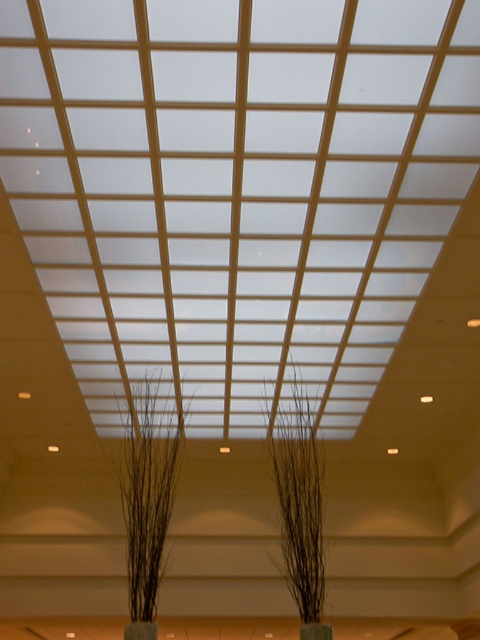
Question: Can you confirm if brown matte plant at center is bigger than black matte plant at center?

Choices:
 (A) yes
 (B) no

Answer: (A)

Question: Which point appears closest to the camera in this image?

Choices:
 (A) (305, 628)
 (B) (135, 627)
 (C) (132, 611)
 (D) (299, 563)

Answer: (B)

Question: Which point is closer to the camera?

Choices:
 (A) (305, 465)
 (B) (144, 449)
 (C) (301, 627)
 (D) (126, 637)

Answer: (C)

Question: Which point is closer to the camera?

Choices:
 (A) (166, 502)
 (B) (291, 467)
 (C) (324, 632)
 (D) (144, 636)

Answer: (D)

Question: Is black matte plant at center wider than green matte vase at lower center?

Choices:
 (A) no
 (B) yes

Answer: (B)

Question: Is black matte plant at center above green matte vase at lower center?

Choices:
 (A) yes
 (B) no

Answer: (A)